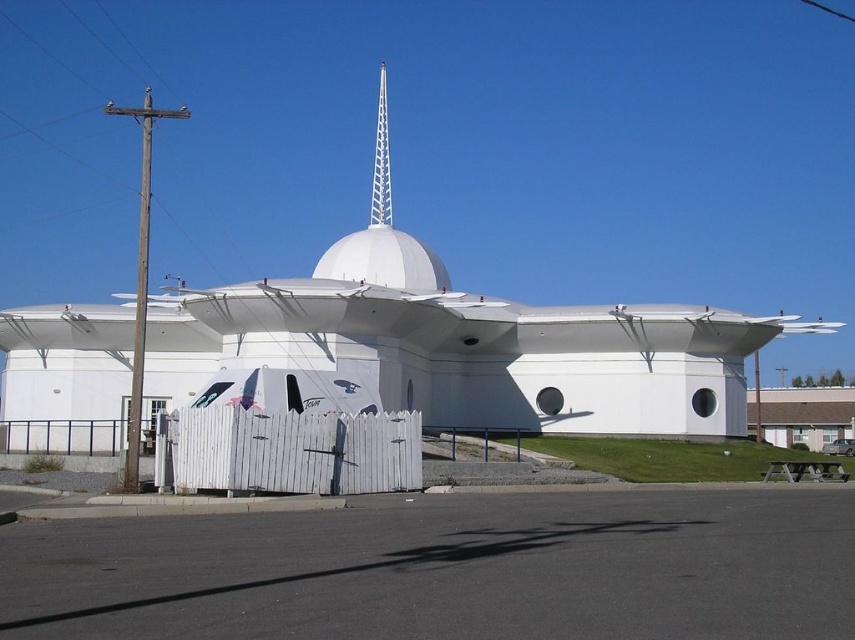
Who is lower down, white picket fence at lower center or white lattice spire at center?

Positioned lower is white picket fence at lower center.

What do you see at coordinates (293, 451) in the screenshot?
I see `white picket fence at lower center` at bounding box center [293, 451].

Is point (302, 440) closer to viewer compared to point (382, 68)?

Yes, it is.

Identify the location of white picket fence at lower center. The height and width of the screenshot is (640, 855). (293, 451).